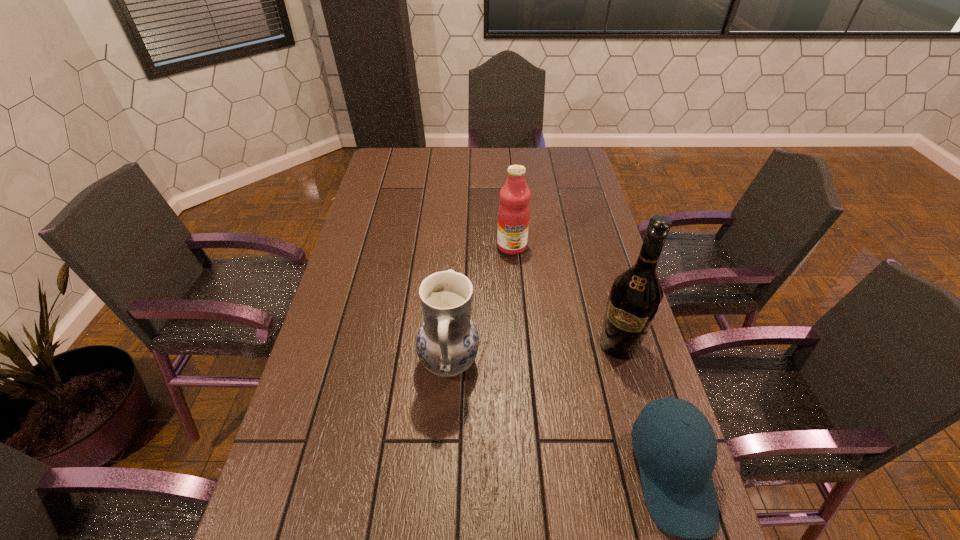
Find the location of a particular element. unoccupied position between the tallest object and the farthest object is located at coordinates (565, 296).

In order to click on free space between the pottery and the wine bottle in this screenshot , I will do `click(534, 354)`.

The width and height of the screenshot is (960, 540). In order to click on free space between the fruit juice and the tallest object in this screenshot , I will do `click(565, 296)`.

Where is `object that is the second closest one to the leftmost object`? Image resolution: width=960 pixels, height=540 pixels. object that is the second closest one to the leftmost object is located at coordinates (635, 297).

The height and width of the screenshot is (540, 960). I want to click on object that is the second closest to the farthest object, so point(635,297).

Image resolution: width=960 pixels, height=540 pixels. Identify the location of vacant space that satisfies the following two spatial constraints: 1. on the back side of the leftmost object; 2. on the left side of the fruit juice. (456, 246).

I want to click on free space that satisfies the following two spatial constraints: 1. on the back side of the leftmost object; 2. on the left side of the third object from right to left, so click(x=456, y=246).

This screenshot has height=540, width=960. I want to click on vacant area in the image that satisfies the following two spatial constraints: 1. on the back side of the tallest object; 2. on the left side of the leftmost object, so click(x=450, y=345).